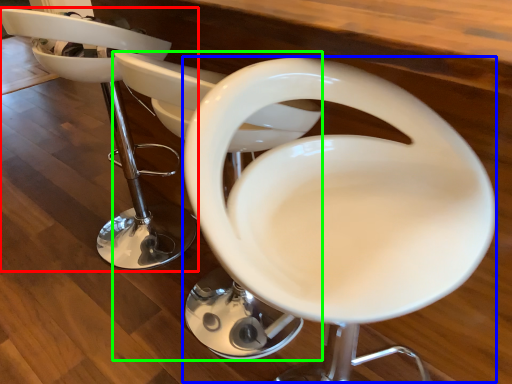
Question: Which object is positioned farthest from chair (highlighted by a red box)? Select from feeding chair (highlighted by a blue box) and feeding chair (highlighted by a green box).

Choices:
 (A) feeding chair
 (B) feeding chair

Answer: (A)